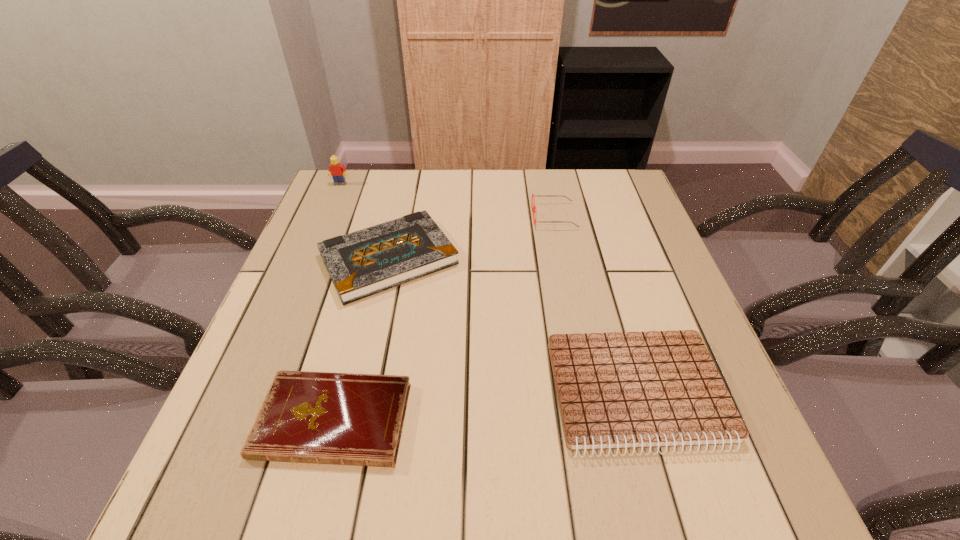
Where is `free space between the tallest object and the rightmost notebook`? free space between the tallest object and the rightmost notebook is located at coordinates (489, 289).

Where is `vacant region between the farthest notebook and the second tallest notebook`? vacant region between the farthest notebook and the second tallest notebook is located at coordinates (513, 326).

Locate an element on the screen. This screenshot has height=540, width=960. vacant point located between the rightmost notebook and the tallest notebook is located at coordinates (513, 326).

Identify the location of vacant space in between the spectacles and the farthest notebook. (471, 238).

This screenshot has height=540, width=960. I want to click on free space between the tallest notebook and the rightmost notebook, so click(x=513, y=326).

This screenshot has height=540, width=960. Find the location of `free space between the tallest notebook and the second tallest notebook`. free space between the tallest notebook and the second tallest notebook is located at coordinates [513, 326].

The image size is (960, 540). I want to click on vacant area that lies between the farthest notebook and the spectacles, so click(x=471, y=238).

The width and height of the screenshot is (960, 540). Find the location of `the second closest object to the spectacles`. the second closest object to the spectacles is located at coordinates (619, 390).

Where is `object that is the second closest one to the second shortest object`? This screenshot has height=540, width=960. object that is the second closest one to the second shortest object is located at coordinates (351, 419).

Locate which notebook is the second closest to the shortest object. Please provide its 2D coordinates. Your answer should be formatted as a tuple, i.e. [(x, y)], where the tuple contains the x and y coordinates of a point satisfying the conditions above.

[(619, 390)]